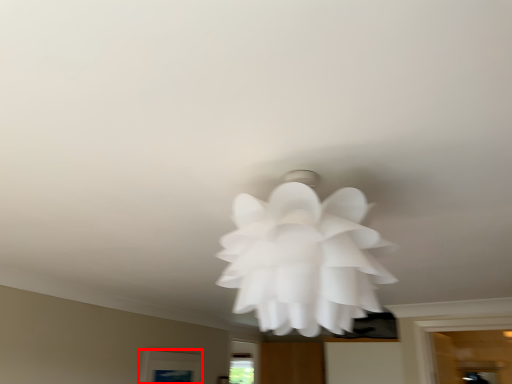
Question: In this image, where is window (annotated by the red box) located relative to flower?

Choices:
 (A) left
 (B) right

Answer: (A)